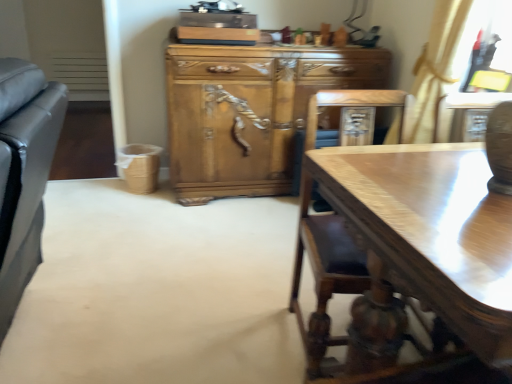
This screenshot has height=384, width=512. I want to click on glossy wood desk at lower right, so click(x=430, y=233).

What do you see at coordinates (430, 233) in the screenshot? I see `glossy wood desk at lower right` at bounding box center [430, 233].

Locate an element on the screen. The image size is (512, 384). light brown wood cabinet at center is located at coordinates (250, 111).

Measure the distance between light brown wood cabinet at center and camera.

light brown wood cabinet at center is 2.36 meters from camera.

This screenshot has width=512, height=384. What do you see at coordinates (250, 111) in the screenshot?
I see `light brown wood cabinet at center` at bounding box center [250, 111].

Measure the distance between point (297, 92) and camera.

The distance of point (297, 92) from camera is 2.55 meters.

You are a GUI agent. You are given a task and a screenshot of the screen. Output one action in this format:
    pyautogui.click(x=<x>, y=<y>)
    Task: Click on the glossy wood desk at lower right
    Image resolution: width=512 pixels, height=384 pixels.
    Given the screenshot: What is the action you would take?
    pyautogui.click(x=430, y=233)

Can you confirm if light brown wood cabinet at center is positioned to the left of glossy wood desk at lower right?

Indeed, light brown wood cabinet at center is positioned on the left side of glossy wood desk at lower right.

Is light brown wood cabinet at center in front of or behind glossy wood desk at lower right in the image?

light brown wood cabinet at center is positioned farther from the viewer than glossy wood desk at lower right.

Is point (199, 145) closer to camera compared to point (367, 211)?

That is False.

From the image's perspective, which is below, light brown wood cabinet at center or glossy wood desk at lower right?

glossy wood desk at lower right, from the image's perspective.

From a real-world perspective, which is physically above, light brown wood cabinet at center or glossy wood desk at lower right?

glossy wood desk at lower right.

Is light brown wood cabinet at center wider than glossy wood desk at lower right?

Yes, light brown wood cabinet at center is wider than glossy wood desk at lower right.

In terms of height, does light brown wood cabinet at center look taller or shorter compared to glossy wood desk at lower right?

light brown wood cabinet at center is taller than glossy wood desk at lower right.

Between light brown wood cabinet at center and glossy wood desk at lower right, which one has smaller size?

glossy wood desk at lower right is smaller.

Does light brown wood cabinet at center contain glossy wood desk at lower right?

No, glossy wood desk at lower right is located outside of light brown wood cabinet at center.

Are light brown wood cabinet at center and glossy wood desk at lower right located far from each other?

Yes, light brown wood cabinet at center and glossy wood desk at lower right are located far from each other.

Is light brown wood cabinet at center looking in the opposite direction of glossy wood desk at lower right?

light brown wood cabinet at center is not turned away from glossy wood desk at lower right.

How distant is light brown wood cabinet at center from glossy wood desk at lower right?

1.48 meters.

Where is `cabinetry above the glossy wood desk at lower right (from the image's perspective)`? This screenshot has height=384, width=512. cabinetry above the glossy wood desk at lower right (from the image's perspective) is located at coordinates (250, 111).

Would you say glossy wood desk at lower right is to the left or to the right of light brown wood cabinet at center in the picture?

Clearly, glossy wood desk at lower right is on the right of light brown wood cabinet at center in the image.

Looking at this image, is glossy wood desk at lower right in front of or behind light brown wood cabinet at center in the image?

glossy wood desk at lower right is in front of light brown wood cabinet at center.

Does point (366, 183) lie behind point (194, 131)?

No, (366, 183) is in front of (194, 131).

From the image's perspective, is glossy wood desk at lower right above light brown wood cabinet at center?

Actually, glossy wood desk at lower right appears below light brown wood cabinet at center in the image.

Consider the image. From a real-world perspective, is glossy wood desk at lower right positioned under light brown wood cabinet at center based on gravity?

No, from a real-world perspective, glossy wood desk at lower right is not below light brown wood cabinet at center.

Considering the relative sizes of glossy wood desk at lower right and light brown wood cabinet at center in the image provided, is glossy wood desk at lower right wider than light brown wood cabinet at center?

No.

Who is shorter, glossy wood desk at lower right or light brown wood cabinet at center?

Standing shorter between the two is glossy wood desk at lower right.

Between glossy wood desk at lower right and light brown wood cabinet at center, which one has smaller size?

glossy wood desk at lower right.

Would you say glossy wood desk at lower right contains light brown wood cabinet at center?

No, glossy wood desk at lower right does not contain light brown wood cabinet at center.

Are glossy wood desk at lower right and light brown wood cabinet at center far apart?

glossy wood desk at lower right is far away from light brown wood cabinet at center.

Looking at this image, does glossy wood desk at lower right turn towards light brown wood cabinet at center?

Yes, glossy wood desk at lower right is oriented towards light brown wood cabinet at center.

How much distance is there between glossy wood desk at lower right and light brown wood cabinet at center?

They are 4.86 feet apart.

The width and height of the screenshot is (512, 384). Identify the location of desk on the right of light brown wood cabinet at center. (430, 233).

Where is `cabinetry behind the glossy wood desk at lower right`? Image resolution: width=512 pixels, height=384 pixels. cabinetry behind the glossy wood desk at lower right is located at coordinates (250, 111).

Identify the location of cabinetry below the glossy wood desk at lower right (from a real-world perspective). This screenshot has height=384, width=512. (250, 111).